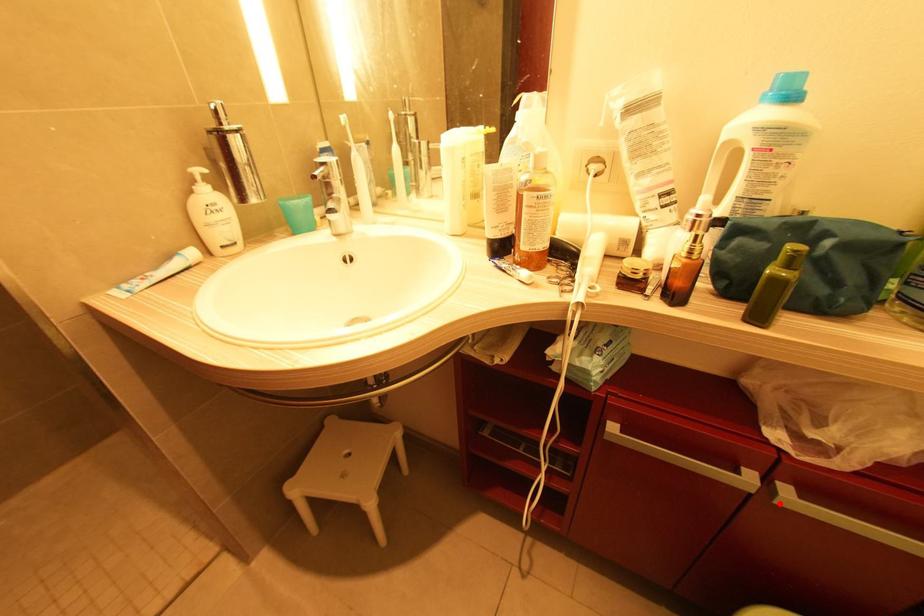
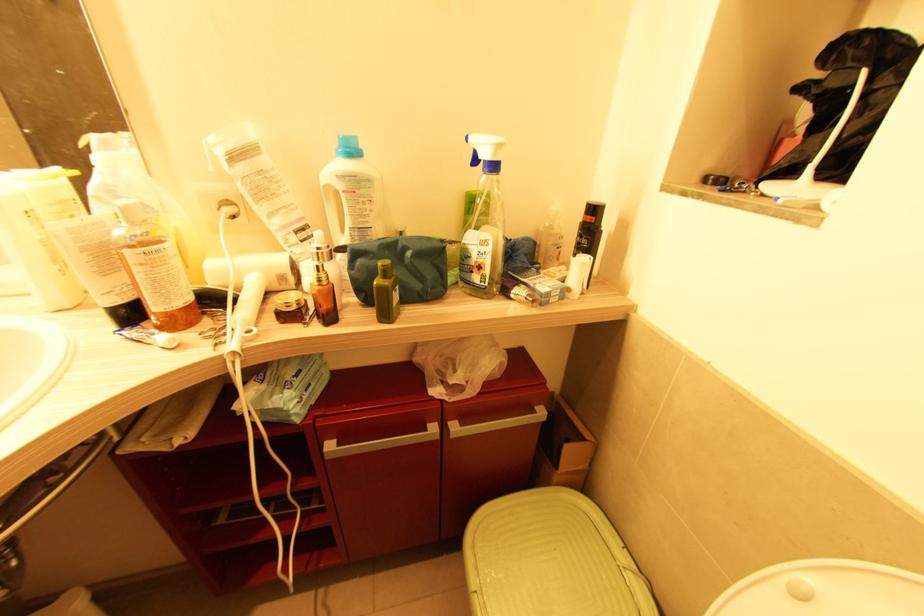
Locate, in the second image, the point that corresponds to the highlighted location in the first image.

(454, 438)